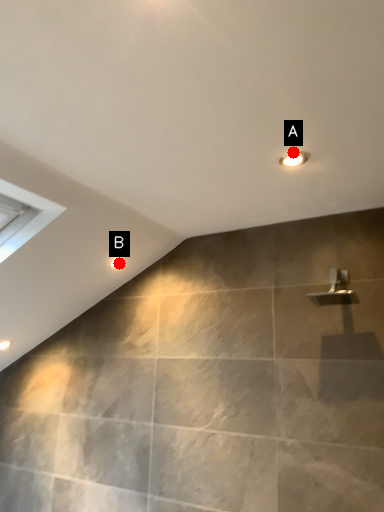
Question: Two points are circled on the image, labeled by A and B beside each circle. Which point is farther from the camera taking this photo?

Choices:
 (A) A is further
 (B) B is further

Answer: (B)